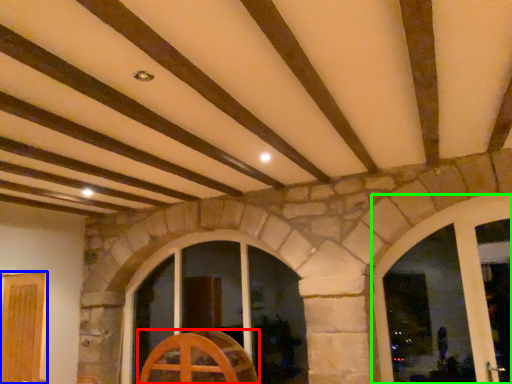
Question: Considering the real-world distances, which object is closest to furniture (highlighted by a red box)? door (highlighted by a blue box) or window (highlighted by a green box).

Choices:
 (A) door
 (B) window

Answer: (A)